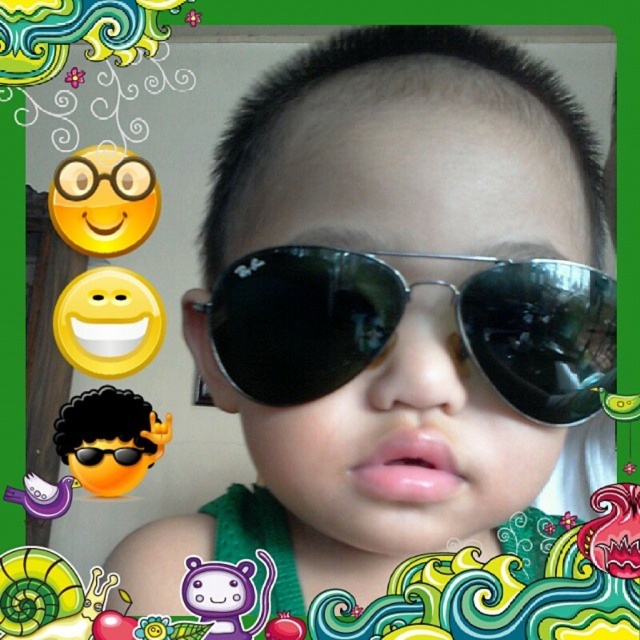
Question: Is matte black sunglasses at center behind black reflective sunglasses at center?

Choices:
 (A) yes
 (B) no

Answer: (B)

Question: Which object is closer to the camera taking this photo?

Choices:
 (A) matte black sunglasses at center
 (B) black reflective sunglasses at center

Answer: (A)

Question: Can you confirm if matte black sunglasses at center is positioned below black reflective sunglasses at center?

Choices:
 (A) no
 (B) yes

Answer: (A)

Question: Does matte black sunglasses at center appear under black reflective sunglasses at center?

Choices:
 (A) yes
 (B) no

Answer: (B)